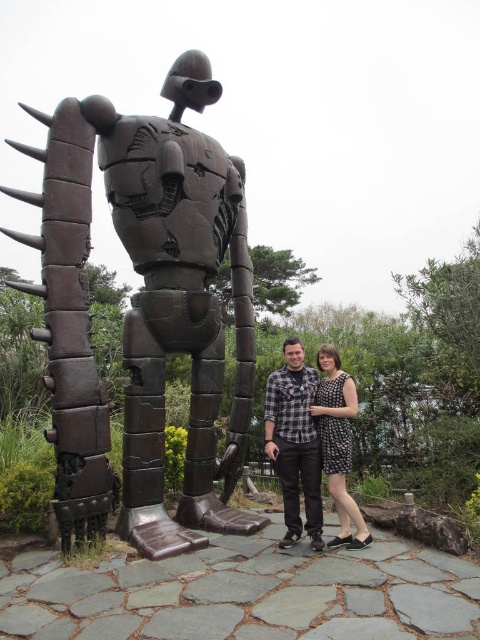
Question: Which point is farther to the camera?

Choices:
 (A) bronze metallic robot at center
 (B) checkered fabric shirt at center
 (C) black dotted dress at center

Answer: (C)

Question: Is checkered fabric shirt at center in front of black dotted dress at center?

Choices:
 (A) no
 (B) yes

Answer: (B)

Question: Does checkered fabric shirt at center lie in front of black dotted dress at center?

Choices:
 (A) no
 (B) yes

Answer: (B)

Question: Is bronze metallic robot at center smaller than checkered fabric shirt at center?

Choices:
 (A) yes
 (B) no

Answer: (B)

Question: Among these points, which one is farthest from the camera?

Choices:
 (A) (274, 461)
 (B) (85, 449)
 (C) (338, 406)

Answer: (A)

Question: Considering the real-world distances, which object is farthest from the black dotted dress at center?

Choices:
 (A) checkered fabric shirt at center
 (B) bronze metallic robot at center

Answer: (B)